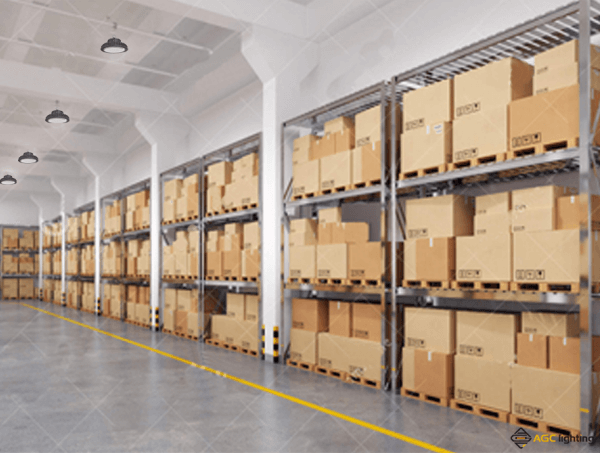
Find the location of `overhead lights`. overhead lights is located at coordinates (120, 49), (63, 114), (30, 157), (7, 181).